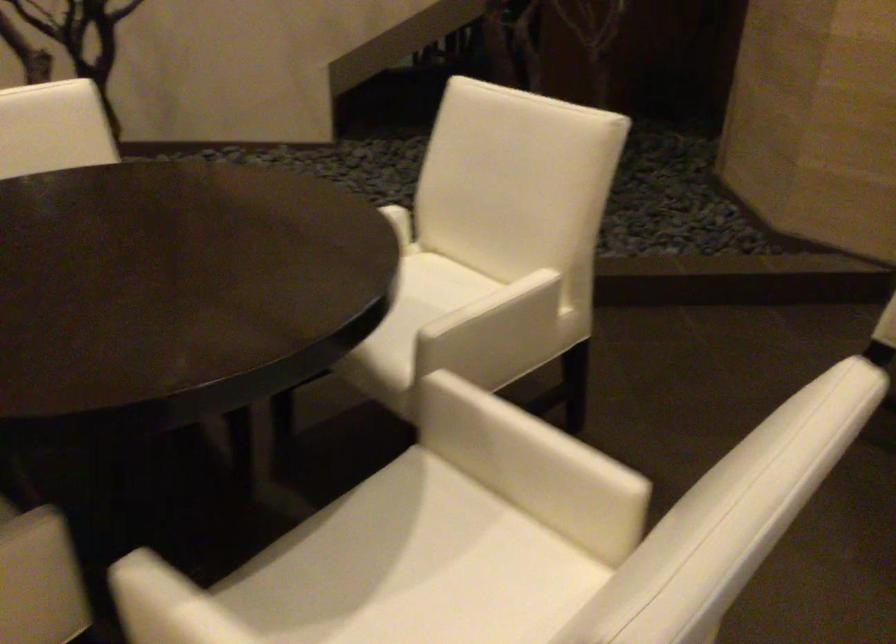
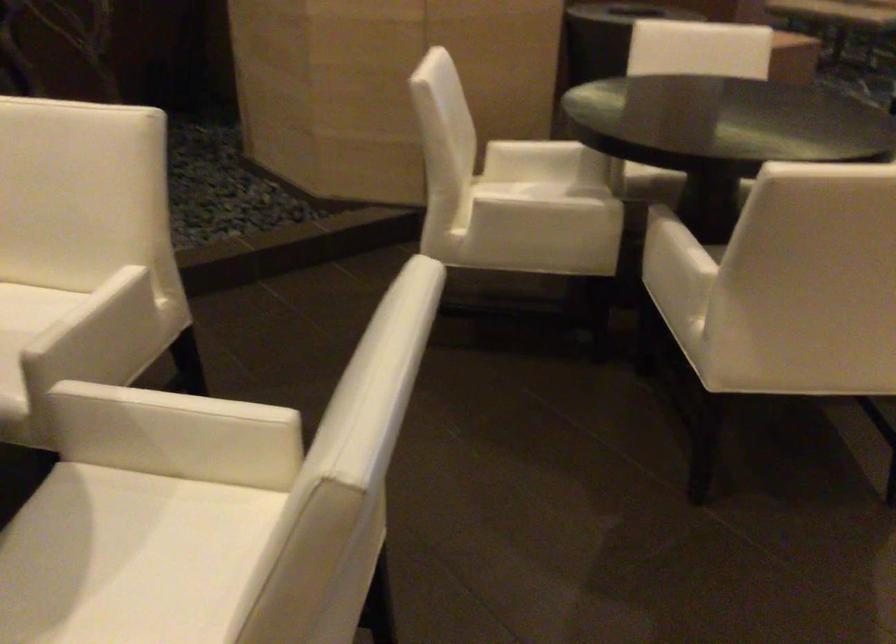
The point at (497, 323) is marked in the first image. Where is the corresponding point in the second image?

(102, 328)